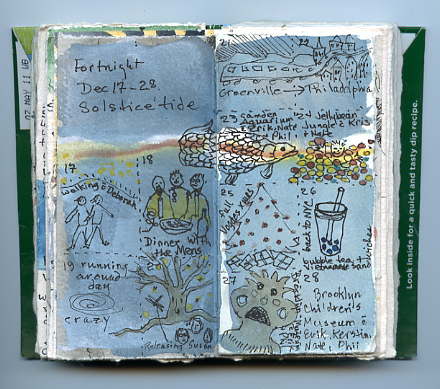
Image resolution: width=440 pixels, height=389 pixels. What are the coordinates of `bowl` in the screenshot? It's located at (172, 225).